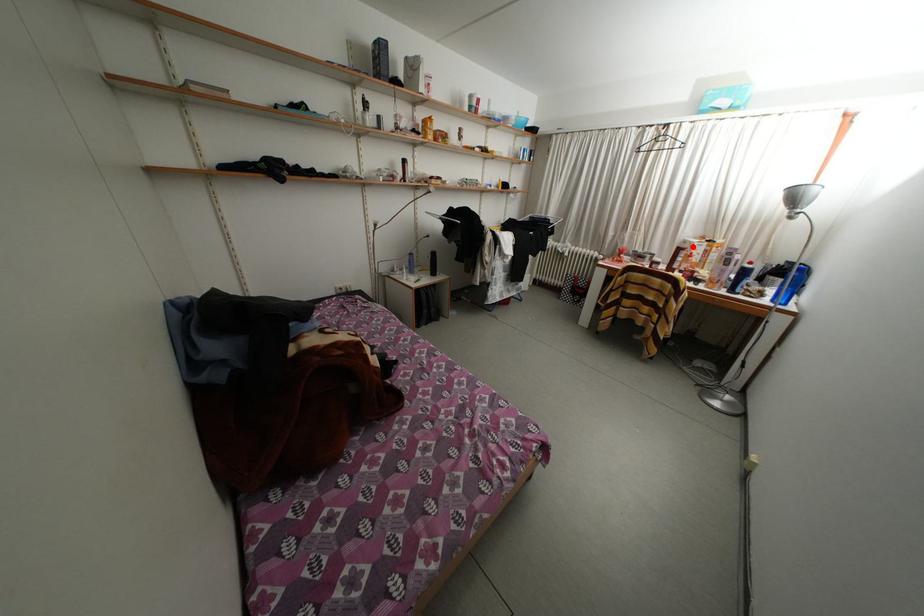
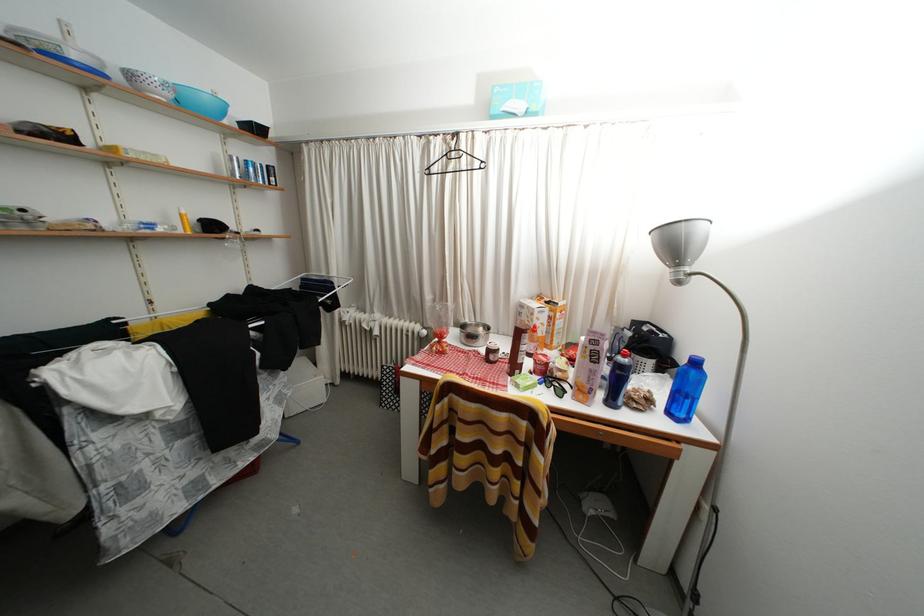
Question: I am providing you with two images of the same scene from different viewpoints. A red point is shown in image1. For the corresponding object point in image2, is it positioned nearer or farther from the camera?

Choices:
 (A) Nearer
 (B) Farther

Answer: (B)